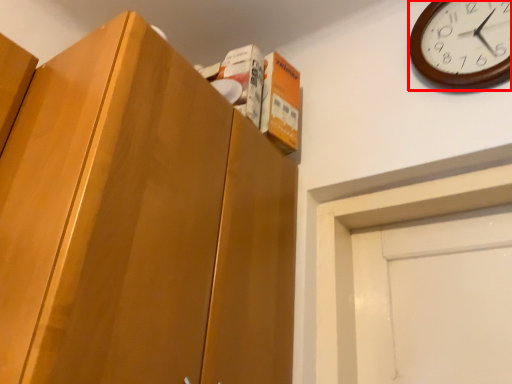
Question: From the image's perspective, what is the correct spatial positioning of wall clock (annotated by the red box) in reference to cabinetry?

Choices:
 (A) above
 (B) below

Answer: (A)